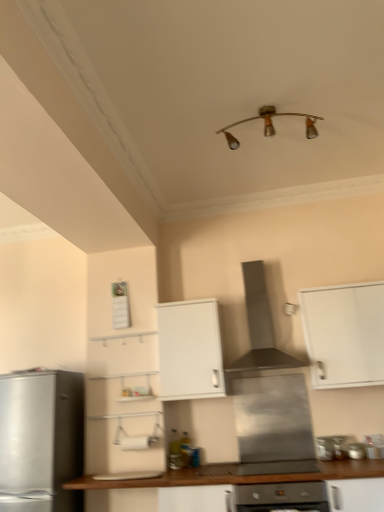
This screenshot has width=384, height=512. I want to click on free space above gold metallic light fixture at upper center (from a real-world perspective), so click(x=266, y=109).